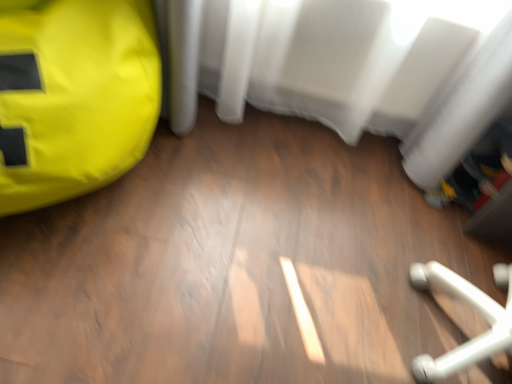
Question: Is white sheer curtain at upper center positioned in front of yellow fabric bean bag at left?

Choices:
 (A) yes
 (B) no

Answer: (B)

Question: From a real-world perspective, is white sheer curtain at upper center on yellow fabric bean bag at left?

Choices:
 (A) no
 (B) yes

Answer: (B)

Question: Is yellow fabric bean bag at left located within white sheer curtain at upper center?

Choices:
 (A) no
 (B) yes

Answer: (A)

Question: Can you confirm if white sheer curtain at upper center is bigger than yellow fabric bean bag at left?

Choices:
 (A) no
 (B) yes

Answer: (A)

Question: Can you confirm if white sheer curtain at upper center is taller than yellow fabric bean bag at left?

Choices:
 (A) yes
 (B) no

Answer: (B)

Question: Does white sheer curtain at upper center have a lesser width compared to yellow fabric bean bag at left?

Choices:
 (A) no
 (B) yes

Answer: (B)

Question: Can you confirm if yellow fabric bean bag at left is wider than white sheer curtain at upper center?

Choices:
 (A) no
 (B) yes

Answer: (B)

Question: From the image's perspective, would you say yellow fabric bean bag at left is shown under white sheer curtain at upper center?

Choices:
 (A) no
 (B) yes

Answer: (B)

Question: Is yellow fabric bean bag at left in contact with white sheer curtain at upper center?

Choices:
 (A) no
 (B) yes

Answer: (A)

Question: Is yellow fabric bean bag at left positioned with its back to white sheer curtain at upper center?

Choices:
 (A) no
 (B) yes

Answer: (A)

Question: Is white sheer curtain at upper center surrounded by yellow fabric bean bag at left?

Choices:
 (A) yes
 (B) no

Answer: (B)

Question: Is yellow fabric bean bag at left not close to white sheer curtain at upper center?

Choices:
 (A) no
 (B) yes

Answer: (A)

Question: From the image's perspective, is yellow fabric bean bag at left above or below white sheer curtain at upper center?

Choices:
 (A) above
 (B) below

Answer: (B)